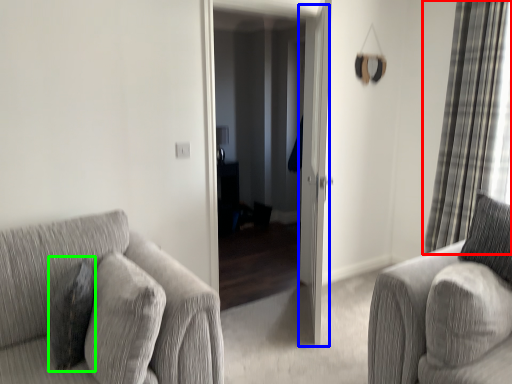
Question: Based on their relative distances, which object is nearer to curtain (highlighted by a red box)? Choose from screen door (highlighted by a blue box) and pillow (highlighted by a green box).

Choices:
 (A) screen door
 (B) pillow

Answer: (A)